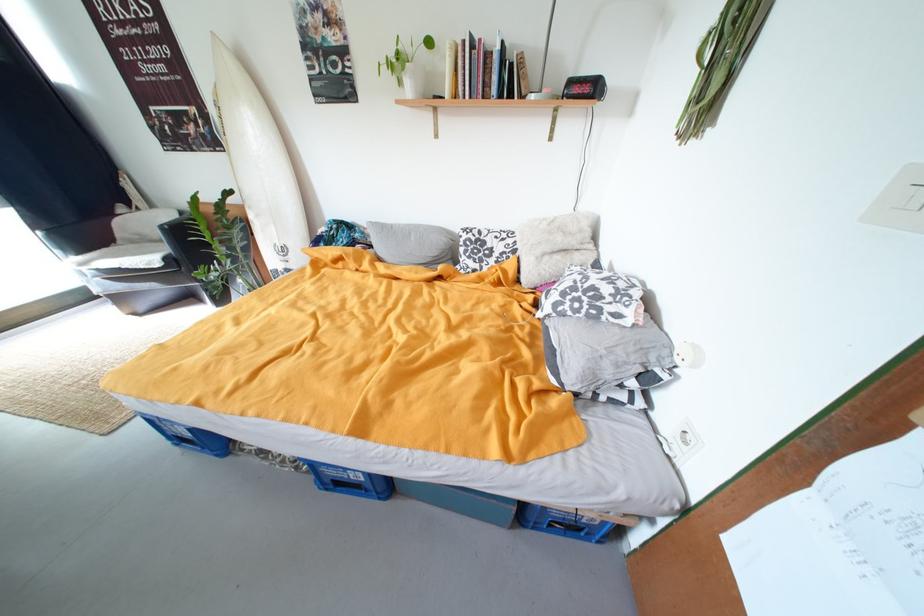
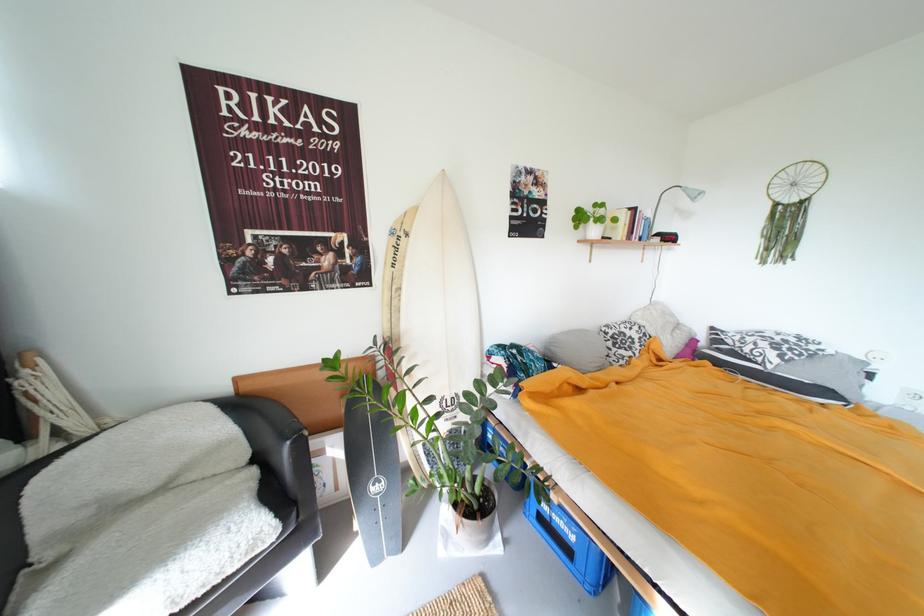
Locate, in the second image, the point that corresponds to point (468, 238) in the first image.

(614, 334)